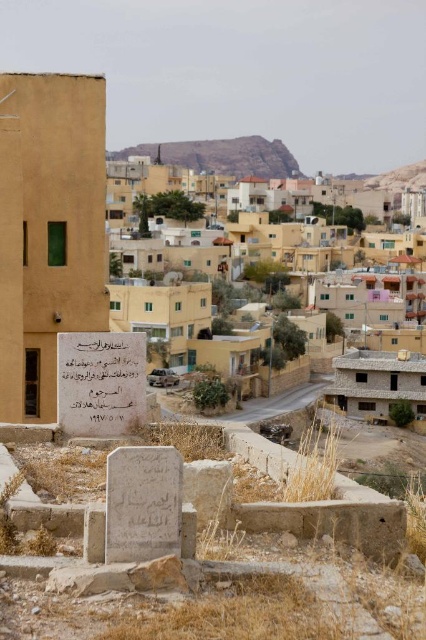
You are standing at the point marked by the coordinates point (307, 241) in the image. What do you see around you?

You are at point (307, 241), which marks beige stone buildings at center. The beige stone buildings at center are surrounded by arid hills and mountains in the background and weathered stone structures in the foreground, suggesting a small town or village setting.

You are a tourist visiting this village and want to take a photo that includes both the stone inscription at center and the brown rocky hillside at upper center. Based on their positions, which object should you place on the right side of your camera frame to ensure both are visible?

The stone inscription at center is to the right of brown rocky hillside at upper center, so to include both in your photo, place the stone inscription at center on the right side of your camera frame.

Based on the photo, you are a historian examining the image of the town and its structures. You notice the stone inscription at center. Based on its coordinates, can you determine if it is positioned closer to the foreground or the midground of the image?

The stone inscription at center is located at point 0.598 on the x axis and 0.237 on the y axis. Since the y coordinate is closer to 0.2, which is near the bottom of the image, it is positioned in the foreground.